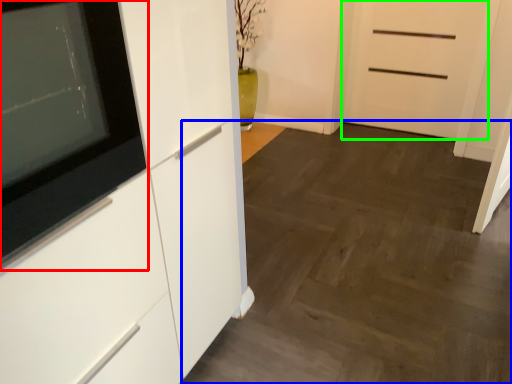
Question: Which object is the farthest from appliance (highlighted by a red box)? Choose among these: plain (highlighted by a blue box) or door (highlighted by a green box).

Choices:
 (A) plain
 (B) door

Answer: (B)